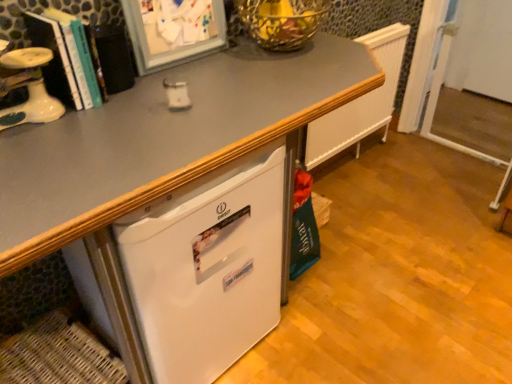
What are the coordinates of `free spot in front of white textured radiator at upper right` in the screenshot? It's located at (374, 215).